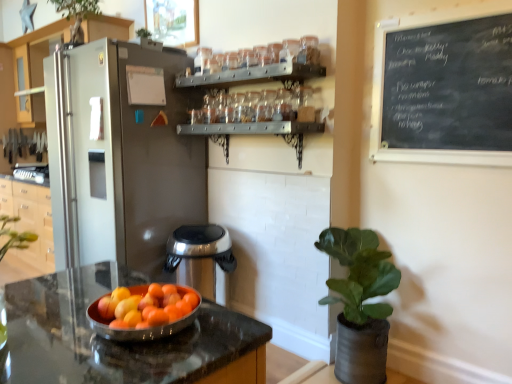
At what (x,y) coordinates should I click in order to perform the action: click on green matte plant at right. Please return your answer as a coordinate pair (x, y). This screenshot has height=384, width=512. Looking at the image, I should click on (360, 303).

Identify the location of clear glass jars at upper center. The height and width of the screenshot is (384, 512). (251, 128).

Is point (90, 1) positioned behind point (331, 249)?

Yes, it is.

Based on the photo, is green leafy plant at upper center placed right next to green matte plant at right?

No, green leafy plant at upper center is not next to green matte plant at right.

From a real-world perspective, does green leafy plant at upper center stand above green matte plant at right?

Yes.

Between green leafy plant at upper center and green matte plant at right, which one is positioned in front?

green matte plant at right is in front.

Considering the positions of point (357, 339) and point (257, 125), is point (357, 339) closer or farther from the camera than point (257, 125)?

Point (357, 339).

Is green matte plant at right bigger than clear glass jars at upper center?

Indeed, green matte plant at right has a larger size compared to clear glass jars at upper center.

Can you tell me how much green matte plant at right and clear glass jars at upper center differ in facing direction?

The angle between the facing direction of green matte plant at right and the facing direction of clear glass jars at upper center is 2.66e-05 degrees.

Considering the positions of objects green matte plant at right and clear glass jars at upper center in the image provided, who is in front, green matte plant at right or clear glass jars at upper center?

green matte plant at right.

Does green matte plant at right appear on the right side of black chalkboard at upper right?

Incorrect, green matte plant at right is not on the right side of black chalkboard at upper right.

Does green matte plant at right come behind black chalkboard at upper right?

Yes, green matte plant at right is behind black chalkboard at upper right.

From a real-world perspective, between green matte plant at right and black chalkboard at upper right, who is vertically higher?

black chalkboard at upper right, from a real-world perspective.

From the image's perspective, is satin silver refrigerator at left located above black chalkboard at upper right?

No, from the image's perspective, satin silver refrigerator at left is not above black chalkboard at upper right.

Considering the sizes of objects satin silver refrigerator at left and black chalkboard at upper right in the image provided, who is shorter, satin silver refrigerator at left or black chalkboard at upper right?

black chalkboard at upper right.

Choose the correct answer: Is satin silver refrigerator at left inside black chalkboard at upper right or outside it?

satin silver refrigerator at left lies outside black chalkboard at upper right.

Can you tell me how much satin silver refrigerator at left and black chalkboard at upper right differ in facing direction?

The angular difference between satin silver refrigerator at left and black chalkboard at upper right is 1.54 degrees.

Is black chalkboard at upper right touching clear glass jars at upper center?

They are not placed beside each other.

Is black chalkboard at upper right inside the boundaries of clear glass jars at upper center, or outside?

black chalkboard at upper right exists outside the volume of clear glass jars at upper center.

Which point is more forward, (421, 27) or (278, 134)?

The point (421, 27) is more forward.

What are the coordinates of `shelf below the black chalkboard at upper right (from the image's perspective)` in the screenshot? It's located at (251, 128).

Is satin silver refrigerator at left closer to camera compared to shiny granite countertop at center?

No, satin silver refrigerator at left is further to the viewer.

Looking at this image, in terms of size, does satin silver refrigerator at left appear bigger or smaller than shiny granite countertop at center?

satin silver refrigerator at left is bigger than shiny granite countertop at center.

Which is more to the left, satin silver refrigerator at left or shiny granite countertop at center?

satin silver refrigerator at left is more to the left.

Considering the positions of points (22, 52) and (249, 373), is point (22, 52) closer to camera compared to point (249, 373)?

That is False.

Is there a large distance between satin silver refrigerator at left and green leafy plant at upper center?

No, satin silver refrigerator at left is in close proximity to green leafy plant at upper center.

From a real-world perspective, relative to green leafy plant at upper center, is satin silver refrigerator at left vertically above or below?

In terms of real-world spatial position, satin silver refrigerator at left is below green leafy plant at upper center.

Relative to green leafy plant at upper center, is satin silver refrigerator at left in front or behind?

Visually, satin silver refrigerator at left is located behind green leafy plant at upper center.

In terms of height, does satin silver refrigerator at left look taller or shorter compared to green leafy plant at upper center?

Clearly, satin silver refrigerator at left is taller compared to green leafy plant at upper center.

Locate an element on the screen. plant located on the left of green matte plant at right is located at coordinates (76, 15).

Find the location of a particular element. The image size is (512, 384). houseplant located underneath the clear glass jars at upper center (from a real-world perspective) is located at coordinates (360, 303).

Which object lies nearer to the anchor point green matte plant at right, green leafy plant at upper center or clear glass jars at upper center?

The object closer to green matte plant at right is clear glass jars at upper center.

From the image, which object appears to be farther from black chalkboard at upper right, satin silver refrigerator at left or shiny granite countertop at center?

Based on the image, satin silver refrigerator at left appears to be further to black chalkboard at upper right.

Considering their positions, is black chalkboard at upper right positioned further to satin silver refrigerator at left than green matte plant at right?

green matte plant at right is positioned further to the anchor satin silver refrigerator at left.

Estimate the real-world distances between objects in this image. Which object is closer to satin silver refrigerator at left, green matte plant at right or shiny granite countertop at center?

The object closer to satin silver refrigerator at left is shiny granite countertop at center.

From the picture: Estimate the real-world distances between objects in this image. Which object is further from clear glass jars at upper center, satin silver refrigerator at left or black chalkboard at upper right?

Based on the image, black chalkboard at upper right appears to be further to clear glass jars at upper center.

Considering their positions, is green leafy plant at upper center positioned further to satin silver refrigerator at left than shiny metallic bowl at center?

The object further to satin silver refrigerator at left is shiny metallic bowl at center.

Based on their spatial positions, is green leafy plant at upper center or black chalkboard at upper right further from clear glass jars at upper center?

Based on the image, green leafy plant at upper center appears to be further to clear glass jars at upper center.

When comparing their distances from shiny granite countertop at center, does satin silver refrigerator at left or clear glass jars at upper center seem closer?

clear glass jars at upper center is positioned closer to the anchor shiny granite countertop at center.

The width and height of the screenshot is (512, 384). I want to click on houseplant between shiny granite countertop at center and black chalkboard at upper right from left to right, so [x=360, y=303].

This screenshot has height=384, width=512. Identify the location of shelf located between shiny metallic bowl at center and green leafy plant at upper center in the depth direction. (251, 128).

Where is `shelf between satin silver refrigerator at left and black chalkboard at upper right from left to right`? Image resolution: width=512 pixels, height=384 pixels. shelf between satin silver refrigerator at left and black chalkboard at upper right from left to right is located at coordinates (251, 128).

Find the location of `plant positioned between shiny granite countertop at center and satin silver refrigerator at left from near to far`. plant positioned between shiny granite countertop at center and satin silver refrigerator at left from near to far is located at coordinates (76, 15).